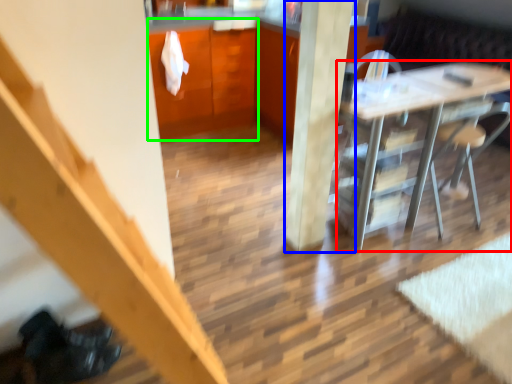
Question: Estimate the real-world distances between objects in this image. Which object is farther from desk (highlighted by a red box), pillar (highlighted by a blue box) or dresser (highlighted by a green box)?

Choices:
 (A) pillar
 (B) dresser

Answer: (B)